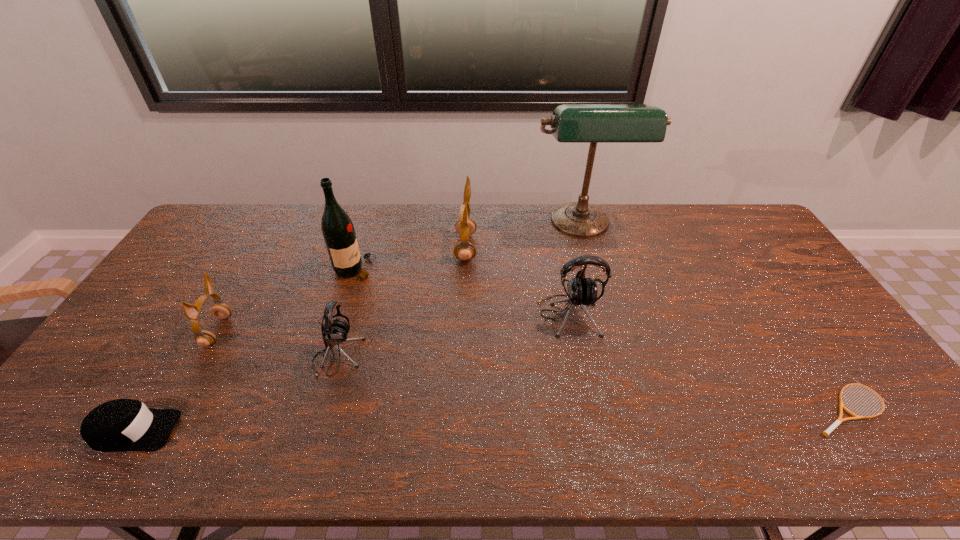
Image resolution: width=960 pixels, height=540 pixels. What are the coordinates of `vacant region that satisfies the following two spatial constraints: 1. on the surface of the green wine bottle; 2. on the right side of the smaller black earphone` in the screenshot? It's located at (328, 357).

Locate an element on the screen. vacant area in the image that satisfies the following two spatial constraints: 1. on the front side of the rightmost earphone; 2. on the right side of the beige tennis racket is located at coordinates (587, 408).

Where is `free point that satisfies the following two spatial constraints: 1. on the front side of the rightmost object; 2. on the left side of the smaller black earphone`? The width and height of the screenshot is (960, 540). free point that satisfies the following two spatial constraints: 1. on the front side of the rightmost object; 2. on the left side of the smaller black earphone is located at coordinates (323, 408).

This screenshot has height=540, width=960. Identify the location of free location that satisfies the following two spatial constraints: 1. above the green lampshade of the green table lamp; 2. on the surface of the green wine bottle. (593, 269).

Locate an element on the screen. This screenshot has width=960, height=540. free space that satisfies the following two spatial constraints: 1. on the back side of the shortest object; 2. on the front-facing side of the smaller brown earphone is located at coordinates (797, 331).

In order to click on vacant space that satisfies the following two spatial constraints: 1. on the back side of the rightmost earphone; 2. on the front-facing side of the third earphone from left to right in this screenshot , I will do 555,248.

Identify the location of free space in the image that satisfies the following two spatial constraints: 1. on the front-facing side of the nearer brown earphone; 2. on the back side of the third earphone from right to left. (203, 357).